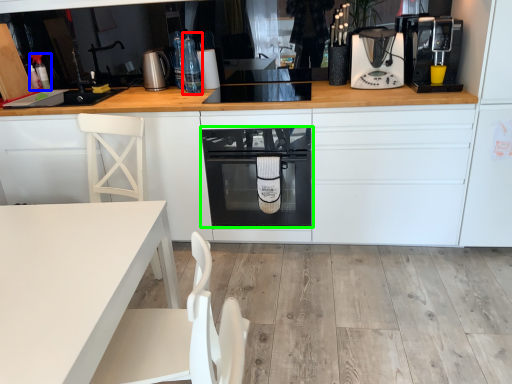
Question: Which is nearer to the bottle (highlighted by a red box)? bottle (highlighted by a blue box) or home appliance (highlighted by a green box).

Choices:
 (A) bottle
 (B) home appliance

Answer: (B)